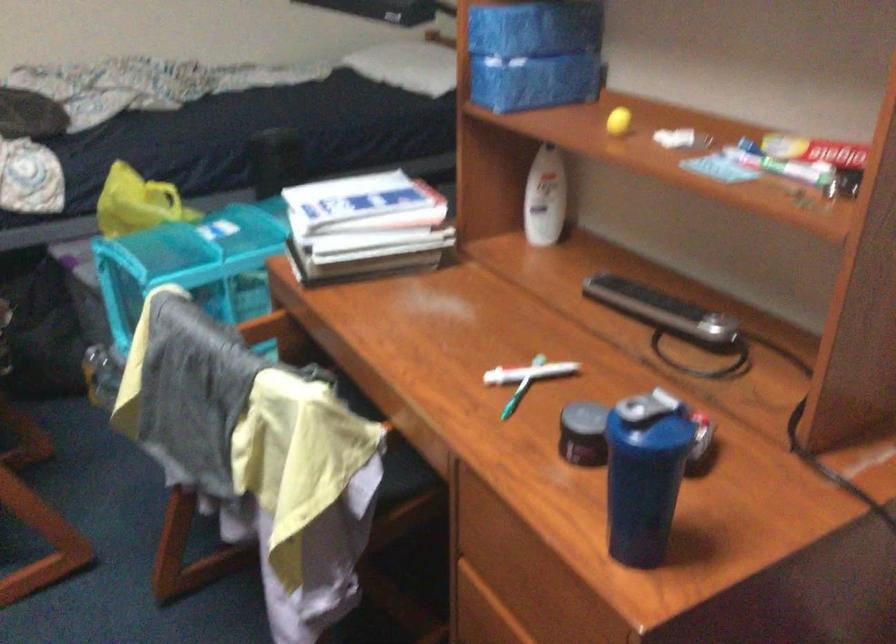
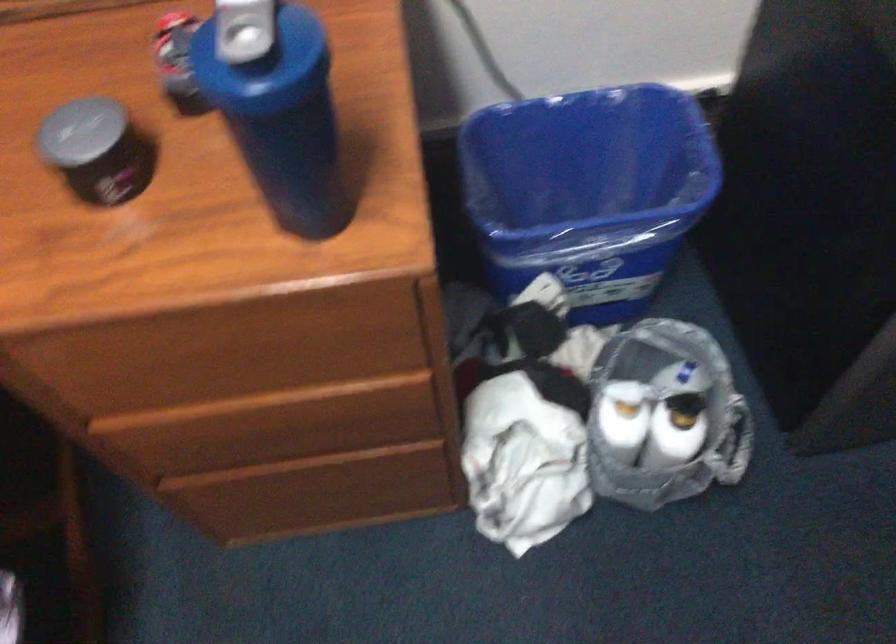
Where in the second image is the point corresponding to point 619,440 from the first image?

(264, 102)